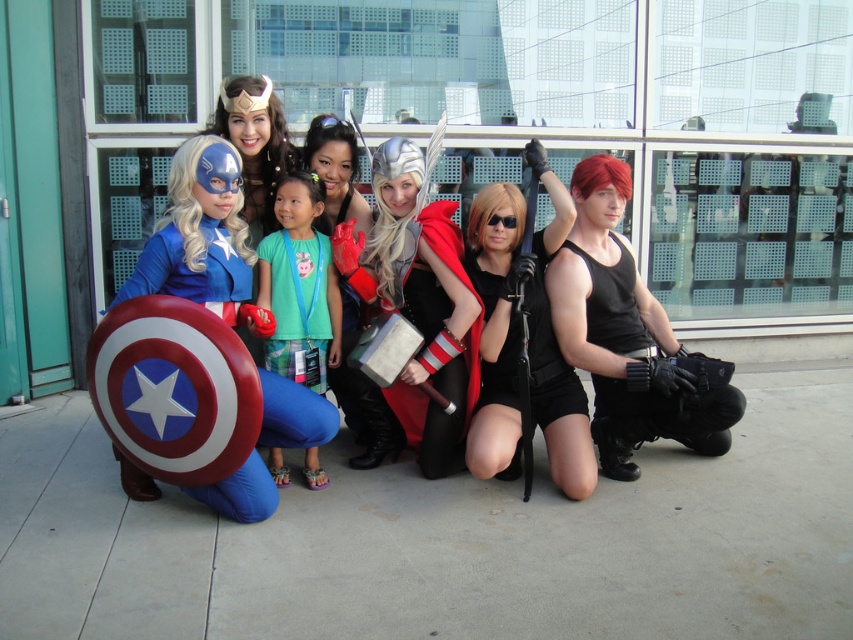
You are holding a camera and want to take a photo of the matte blue costume at lower left without getting too close. The camera has a maximum zoom range of 5 meters. Is the current distance sufficient to capture the costume clearly without moving closer?

The matte blue costume at lower left and camera are 2.78 meters apart from each other. Since the camera can zoom up to 5 meters, the distance of 2.78 meters is within the maximum range, so you can capture the costume clearly without moving closer.

Consider the image. You are a photographer trying to capture a photo of the silver metallic hammer at center and the silver metallic helmet at center. Which object should you focus on first if you want to include both in your frame without moving the camera?

The silver metallic hammer at center is positioned on the right side of silver metallic helmet at center, so you should focus on the silver metallic helmet at center first to ensure both are in frame.